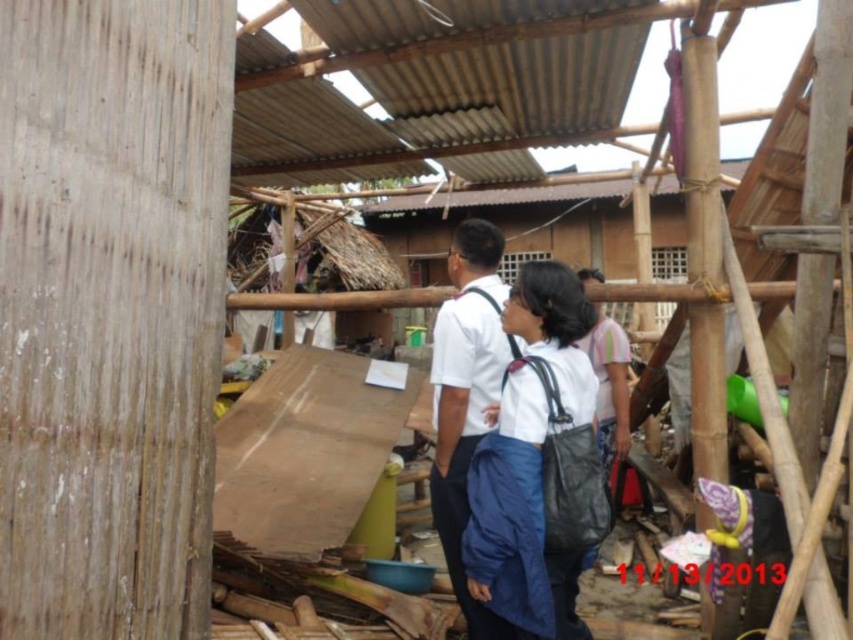
Can you confirm if white fabric backpack at center is positioned to the right of white matte shirt at center?

Correct, you'll find white fabric backpack at center to the right of white matte shirt at center.

Between white fabric backpack at center and white matte shirt at center, which one is positioned higher?

white matte shirt at center is higher up.

Locate an element on the screen. The height and width of the screenshot is (640, 853). white fabric backpack at center is located at coordinates (531, 460).